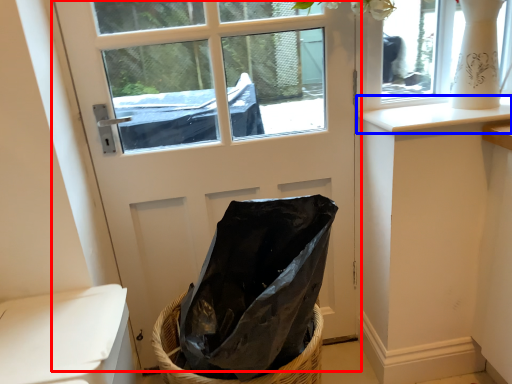
Question: Which object is closer to the camera taking this photo, door (highlighted by a red box) or window sill (highlighted by a blue box)?

Choices:
 (A) door
 (B) window sill

Answer: (A)